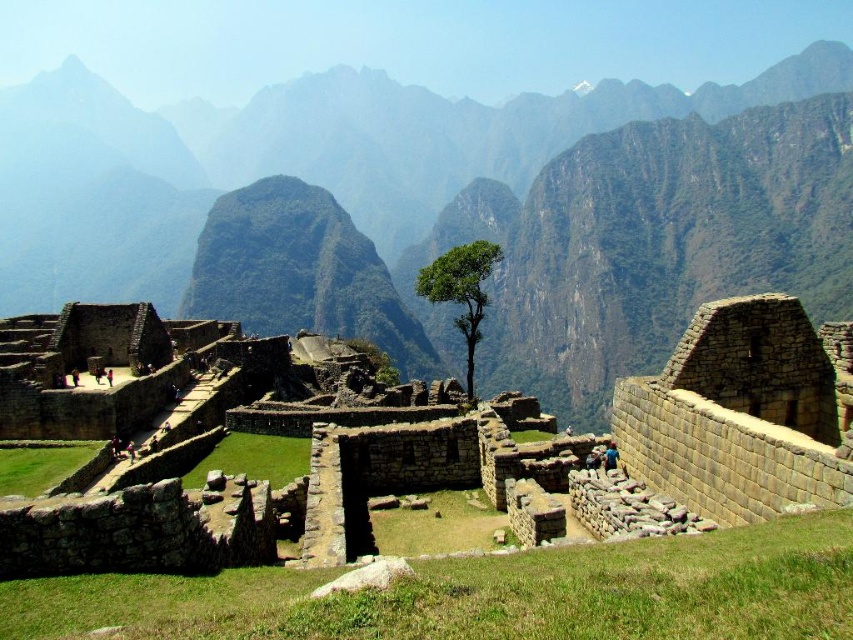
How distant is rugged stone mountain at center from green leafy tree at center?

167.48 meters

Does rugged stone mountain at center have a lesser width compared to green leafy tree at center?

No.

Does point (437, 225) come behind point (473, 246)?

Yes, point (437, 225) is behind point (473, 246).

What are the coordinates of `rugged stone mountain at center` in the screenshot? It's located at (457, 216).

Between rugged stone mountain at center and brown stone ruins at center, which one has less height?

Standing shorter between the two is brown stone ruins at center.

Who is more distant from viewer, [685,276] or [737,369]?

The point [685,276] is more distant.

Is point (109, 173) closer to camera compared to point (840, 394)?

That is False.

Identify the location of rugged stone mountain at center. (457, 216).

Between brown stone ruins at center and green leafy tree at center, which one appears on the left side from the viewer's perspective?

brown stone ruins at center is more to the left.

Which is above, brown stone ruins at center or green leafy tree at center?

green leafy tree at center

Image resolution: width=853 pixels, height=640 pixels. What do you see at coordinates (416, 442) in the screenshot?
I see `brown stone ruins at center` at bounding box center [416, 442].

Locate an element on the screen. This screenshot has width=853, height=640. brown stone ruins at center is located at coordinates point(416,442).